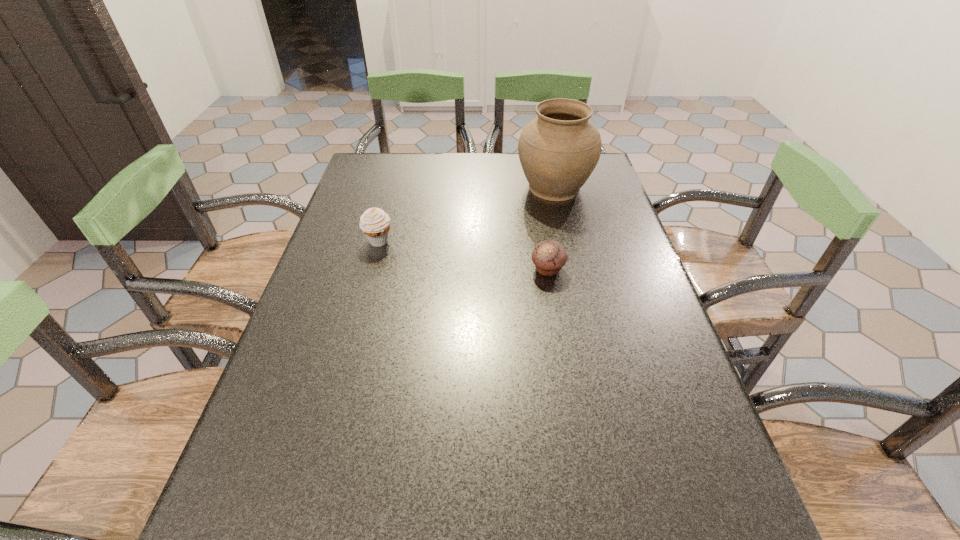
Point out which object is positioned as the second nearest to the urn. Please provide its 2D coordinates. Your answer should be formatted as a tuple, i.e. [(x, y)], where the tuple contains the x and y coordinates of a point satisfying the conditions above.

[(375, 223)]

Identify which object is located as the nearest to the urn. Please provide its 2D coordinates. Your answer should be formatted as a tuple, i.e. [(x, y)], where the tuple contains the x and y coordinates of a point satisfying the conditions above.

[(549, 256)]

Locate an element on the screen. the second closest muffin to the tallest object is located at coordinates (375, 223).

Identify the location of free region that satisfies the following two spatial constraints: 1. on the back side of the taller muffin; 2. on the right side of the urn. This screenshot has height=540, width=960. (394, 187).

Locate an element on the screen. free space that satisfies the following two spatial constraints: 1. on the back side of the farthest object; 2. on the right side of the shorter muffin is located at coordinates (534, 187).

Where is `free spot that satisfies the following two spatial constraints: 1. on the back side of the tallest object; 2. on the right side of the farther muffin`? The width and height of the screenshot is (960, 540). free spot that satisfies the following two spatial constraints: 1. on the back side of the tallest object; 2. on the right side of the farther muffin is located at coordinates (394, 187).